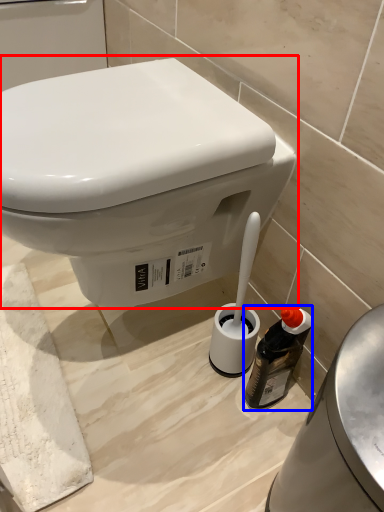
Question: Among these objects, which one is nearest to the camera, toilet (highlighted by a red box) or bottle (highlighted by a blue box)?

Choices:
 (A) toilet
 (B) bottle

Answer: (A)